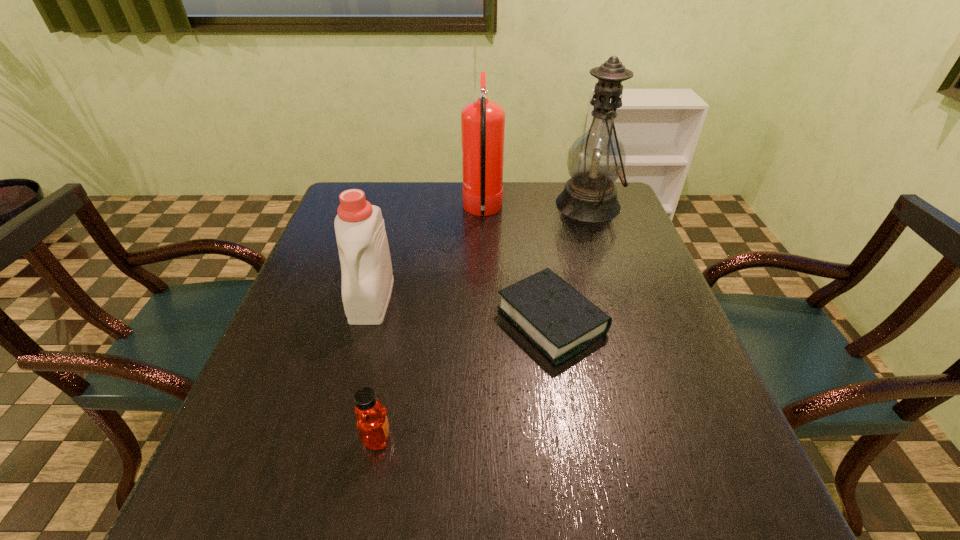
The height and width of the screenshot is (540, 960). In order to click on free region at the far edge in this screenshot , I will do `click(455, 222)`.

I want to click on blank area at the near edge, so click(x=616, y=534).

The height and width of the screenshot is (540, 960). What are the coordinates of `vacant space at the left edge of the desktop` in the screenshot? It's located at (226, 461).

Locate an element on the screen. free space at the right edge of the desktop is located at coordinates [x=669, y=403].

Identify the location of blank area at the near left corner. (288, 496).

Where is `empty space between the fire extinguisher and the oil lamp`? empty space between the fire extinguisher and the oil lamp is located at coordinates (536, 208).

Image resolution: width=960 pixels, height=540 pixels. Identify the location of empty space that is in between the oil lamp and the nearest object. (483, 321).

Identify the location of free space between the nearest object and the third shortest object. The image size is (960, 540). (374, 368).

In order to click on free space between the oil lamp and the detergent in this screenshot , I will do `click(480, 252)`.

The height and width of the screenshot is (540, 960). What are the coordinates of `empty space that is in between the oil lamp and the fourth tallest object` in the screenshot? It's located at (483, 321).